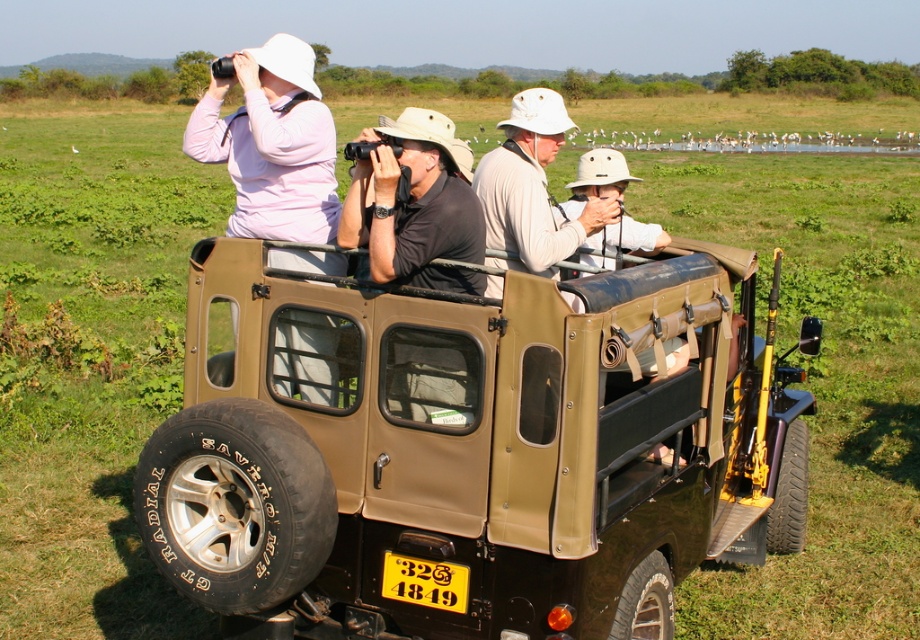
Question: Considering the real-world distances, which object is closest to the yellow matte license plate at rear?

Choices:
 (A) matte pink sweater at upper left
 (B) matte black shirt at center

Answer: (A)

Question: In this image, where is matte khaki jeep at center located relative to yellow matte license plate at rear?

Choices:
 (A) left
 (B) right

Answer: (B)

Question: Which is farther from the matte black shirt at center?

Choices:
 (A) matte khaki jeep at center
 (B) yellow matte license plate at rear

Answer: (A)

Question: Does matte pink sweater at upper left appear on the right side of yellow matte license plate at rear?

Choices:
 (A) no
 (B) yes

Answer: (A)

Question: Which object is the closest to the matte black shirt at center?

Choices:
 (A) matte khaki jeep at center
 (B) matte pink sweater at upper left

Answer: (A)

Question: Observing the image, what is the correct spatial positioning of matte pink sweater at upper left in reference to yellow matte license plate at rear?

Choices:
 (A) above
 (B) below

Answer: (A)